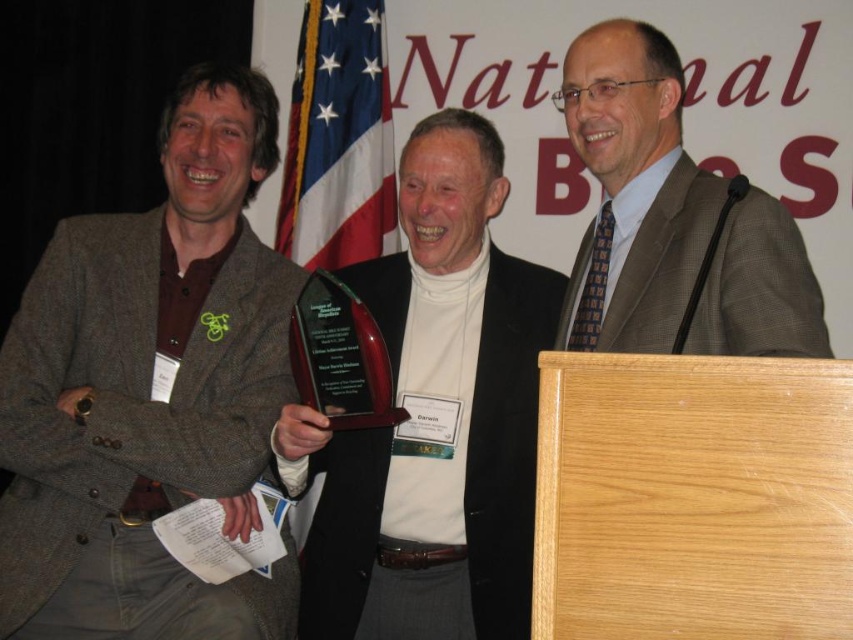
Question: Does matte brown blazer at center come behind plaid wool suit at center?

Choices:
 (A) no
 (B) yes

Answer: (B)

Question: Which object is farther from the camera taking this photo?

Choices:
 (A) shiny dark wood award at center
 (B) matte brown blazer at center
 (C) plaid wool suit at center

Answer: (B)

Question: Does matte brown blazer at center appear over plaid wool suit at center?

Choices:
 (A) no
 (B) yes

Answer: (A)

Question: Does matte brown blazer at center have a larger size compared to shiny dark wood award at center?

Choices:
 (A) no
 (B) yes

Answer: (B)

Question: Which point is closer to the camera?

Choices:
 (A) matte brown blazer at center
 (B) shiny dark wood award at center

Answer: (B)

Question: Estimate the real-world distances between objects in this image. Which object is farther from the shiny dark wood award at center?

Choices:
 (A) matte brown blazer at center
 (B) plaid wool suit at center

Answer: (B)